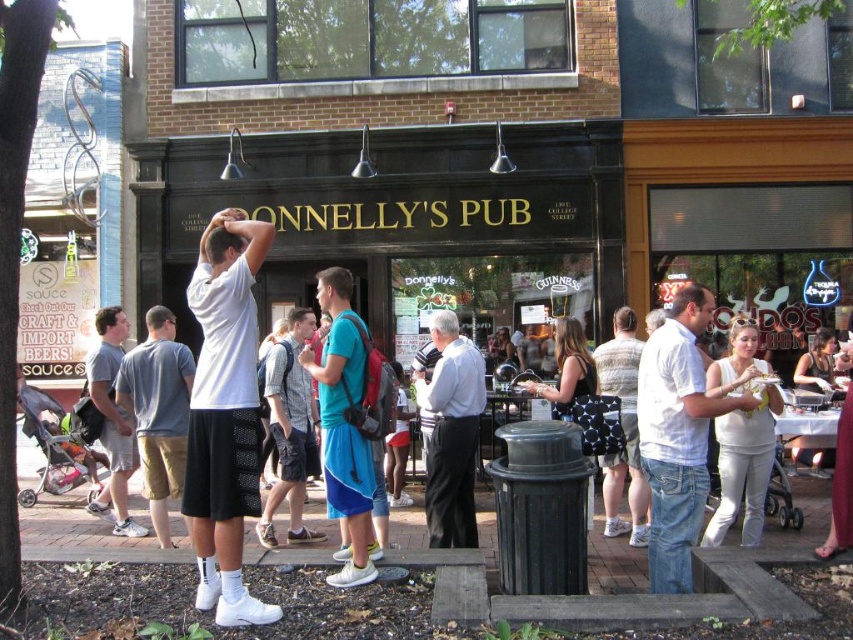
You are a photographer taking a picture of the scene outside Donnelly Pub. You notice the white matte shorts at center and the white cotton shirt at center. Which object should you focus on first if you want to capture the one closer to the left side?

The white matte shorts at center is to the left of the white cotton shirt at center, so you should focus on the white matte shorts at center first since it is closer to the left side.